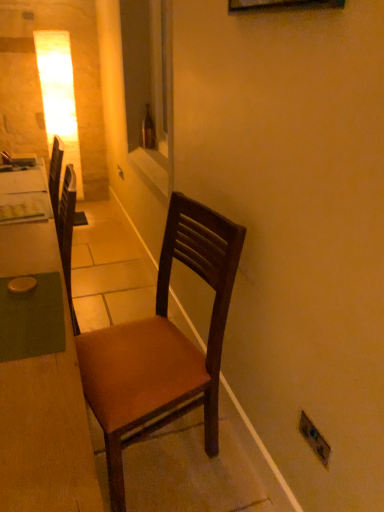
Where is `vacant space in front of brown glass bottle at center`? vacant space in front of brown glass bottle at center is located at coordinates (147, 152).